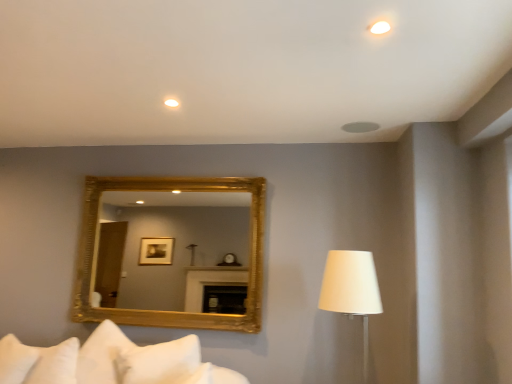
At what (x,y) coordinates should I click in order to perform the action: click on vacant space that's between white matte ceiling light at upper center, placed as the first lighting when sorted from left to right, and white matte ceiling light at upper center, the 1th lighting positioned from the top. Please return your answer as a coordinate pair (x, y). Image resolution: width=512 pixels, height=384 pixels. Looking at the image, I should click on (259, 66).